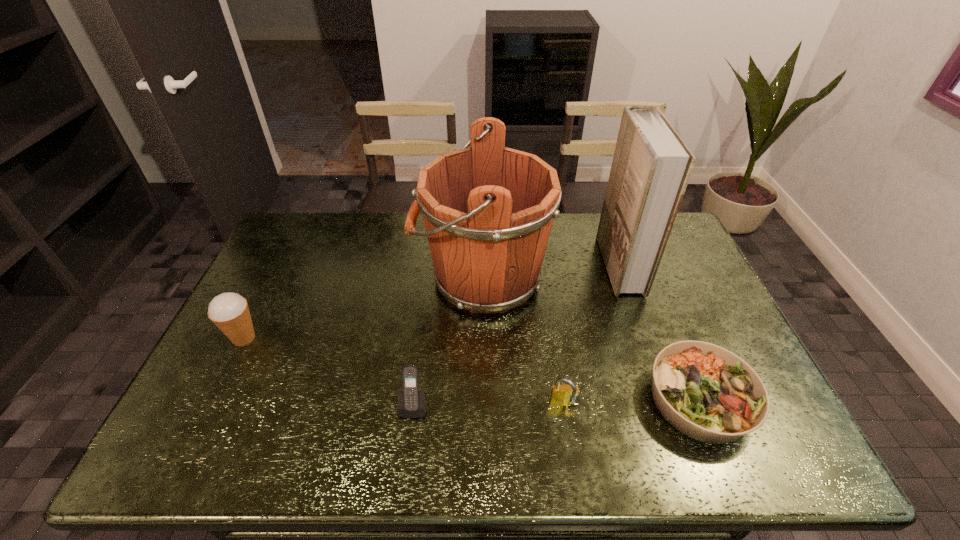
Image resolution: width=960 pixels, height=540 pixels. In order to click on phonebook in this screenshot , I will do `click(651, 167)`.

The width and height of the screenshot is (960, 540). I want to click on bucket, so click(488, 210).

The image size is (960, 540). In order to click on the leftmost object in this screenshot , I will do `click(229, 311)`.

Identify the location of the third tallest object. pyautogui.click(x=229, y=311).

You are a GUI agent. You are given a task and a screenshot of the screen. Output one action in this format:
    pyautogui.click(x=<x>, y=<y>)
    Task: Click on the cellular telephone
    This screenshot has width=960, height=540.
    Given the screenshot: What is the action you would take?
    pyautogui.click(x=411, y=402)

I want to click on the fifth tallest object, so click(x=560, y=394).

Locate an element on the screen. This screenshot has height=540, width=960. salad plate is located at coordinates (706, 392).

Where is `free point located on the cover of the phonebook`? This screenshot has width=960, height=540. free point located on the cover of the phonebook is located at coordinates (504, 265).

What are the coordinates of `vacant space located 0.180m on the cover of the phonebook` in the screenshot? It's located at (549, 265).

Identify the location of vacant space located on the cover of the phonebook. The width and height of the screenshot is (960, 540). (538, 265).